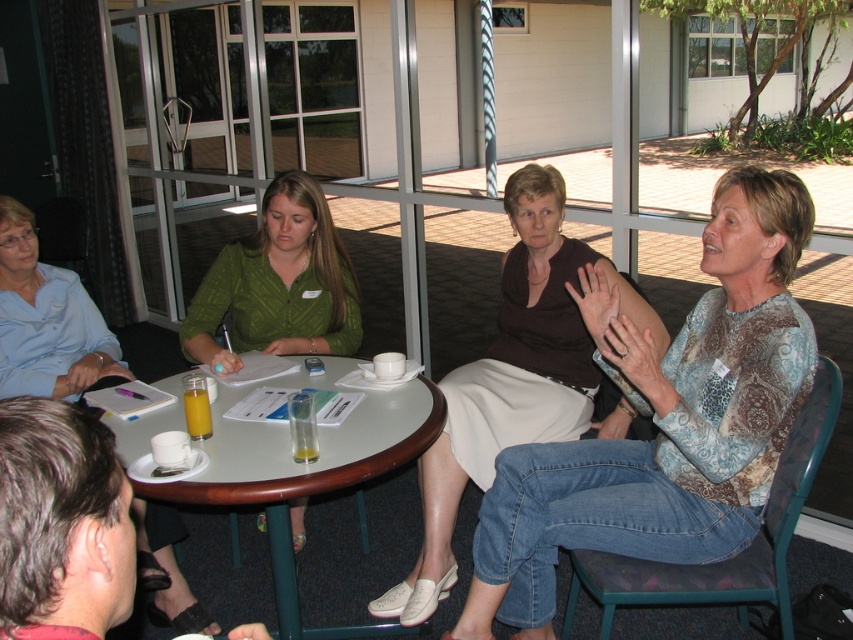
Question: Is patterned fabric blouse at center closer to the viewer compared to light blue shirt at upper left?

Choices:
 (A) no
 (B) yes

Answer: (B)

Question: Which of these objects is positioned farthest from the patterned fabric blouse at center?

Choices:
 (A) light blue shirt at upper left
 (B) green textured blouse at center

Answer: (A)

Question: Which point appears closest to the camera in this image?

Choices:
 (A) (584, 244)
 (B) (16, 253)

Answer: (A)

Question: Does white glossy table at center have a lesser width compared to light blue shirt at upper left?

Choices:
 (A) yes
 (B) no

Answer: (B)

Question: Is brown jersey at center below white glossy table at center?

Choices:
 (A) no
 (B) yes

Answer: (A)

Question: Which of the following is the farthest from the observer?

Choices:
 (A) (292, 285)
 (B) (683, 593)
 (C) (483, 438)

Answer: (A)